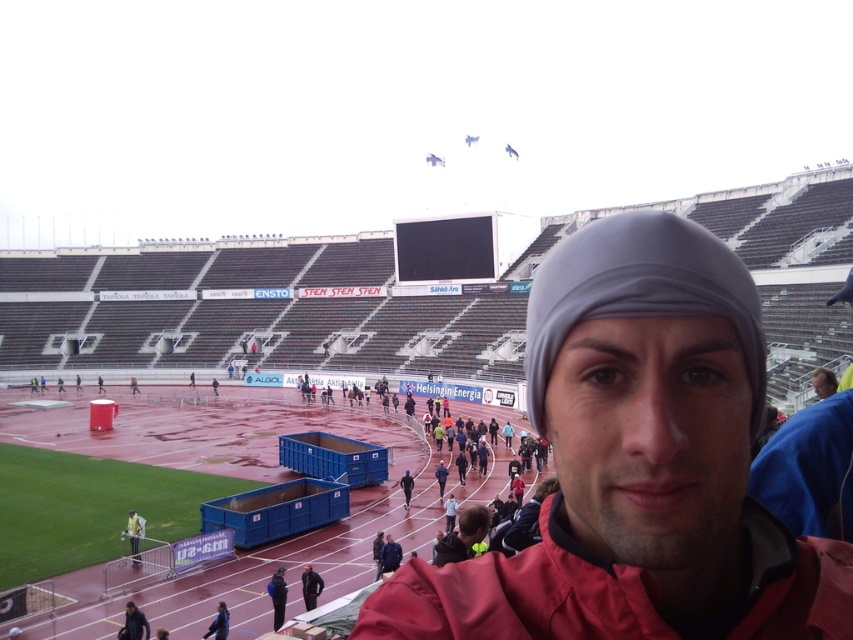
Describe the element at coordinates (462, 536) in the screenshot. The image size is (853, 640). I see `red jacket at lower center` at that location.

Is point (462, 540) more distant than point (318, 577)?

No, (462, 540) is closer to viewer.

Who is more forward, (462, 556) or (322, 582)?

Point (462, 556) is in front.

Where is `red jacket at lower center`? This screenshot has width=853, height=640. red jacket at lower center is located at coordinates (462, 536).

Can you confirm if red matte jacket at center is wider than red jacket at lower center?

Correct, the width of red matte jacket at center exceeds that of red jacket at lower center.

Who is more distant from viewer, (606, 387) or (476, 536)?

The point (476, 536) is behind.

The image size is (853, 640). Find the location of `red matte jacket at center`. red matte jacket at center is located at coordinates (637, 465).

Does red matte jacket at center have a larger size compared to black matte jacket at lower center?

Yes.

Is red matte jacket at center in front of black matte jacket at lower center?

Yes.

Who is more forward, (x=363, y=616) or (x=314, y=602)?

Point (x=363, y=616)

This screenshot has height=640, width=853. Find the location of `red matte jacket at center`. red matte jacket at center is located at coordinates (637, 465).